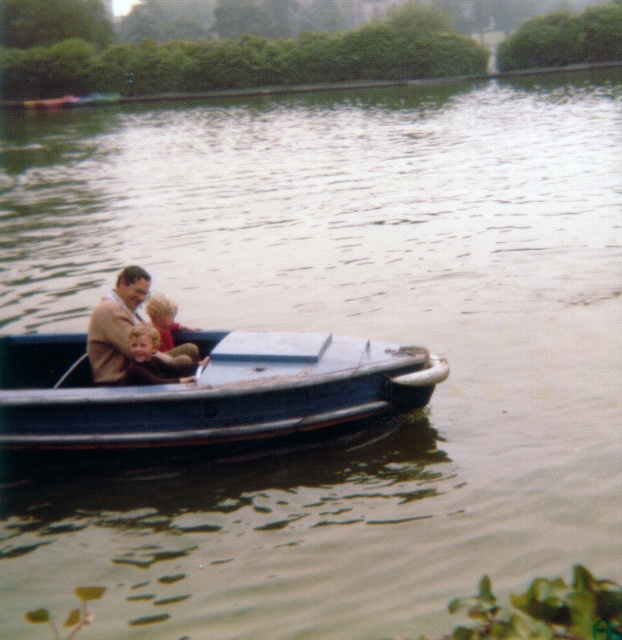
Question: Among these points, which one is nearest to the camera?

Choices:
 (A) (68, 417)
 (B) (174, 371)

Answer: (A)

Question: Can you confirm if blue metallic boat at center is positioned to the left of brown woolen suit at center?

Choices:
 (A) yes
 (B) no

Answer: (B)

Question: Can you confirm if blue metallic boat at center is smaller than brown woolen suit at center?

Choices:
 (A) no
 (B) yes

Answer: (A)

Question: Does blue metallic boat at center appear over brown woolen suit at center?

Choices:
 (A) yes
 (B) no

Answer: (B)